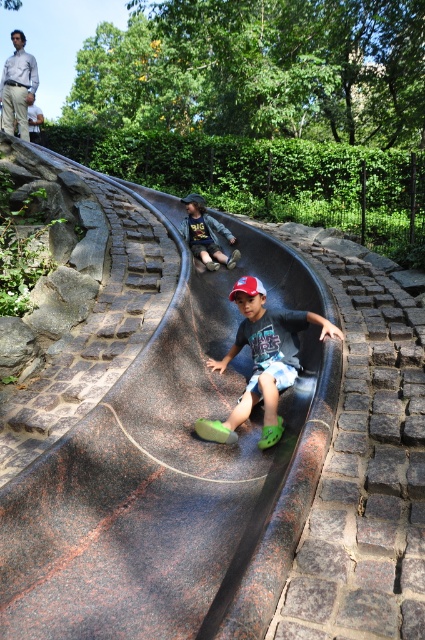
Does rubberized smooth slide at center have a greater height compared to green rubber shoes at center?

Yes, rubberized smooth slide at center is taller than green rubber shoes at center.

This screenshot has width=425, height=640. Identify the location of rubberized smooth slide at center. (150, 442).

Which is in front, point (121, 557) or point (206, 420)?

Point (121, 557) is in front.

Where is `rubberized smooth slide at center`? rubberized smooth slide at center is located at coordinates (150, 442).

Which is behind, point (91, 579) or point (220, 230)?

The point (220, 230) is behind.

Where is `rubberized smooth slide at center`? rubberized smooth slide at center is located at coordinates pos(150,442).

Can you confirm if white shirt at upper left is positioned below dark blue denim jacket at center?

No, white shirt at upper left is not below dark blue denim jacket at center.

Is white shirt at upper left wider than dark blue denim jacket at center?

Yes.

You are a GUI agent. You are given a task and a screenshot of the screen. Output one action in this format:
    pyautogui.click(x=<x>, y=<y>)
    Task: Click on the white shirt at upper left
    
    Given the screenshot: What is the action you would take?
    pyautogui.click(x=17, y=86)

The height and width of the screenshot is (640, 425). Find the location of `white shirt at upper left`. white shirt at upper left is located at coordinates (17, 86).